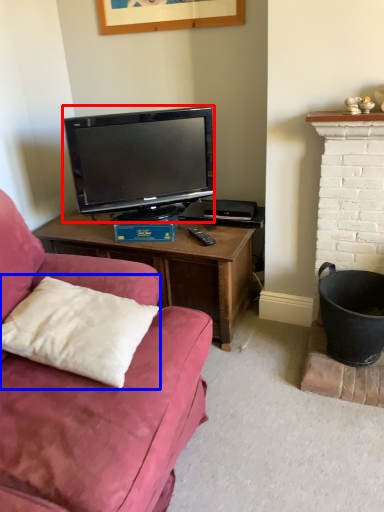
Question: Which point is further to the camera, television (highlighted by a red box) or pillow (highlighted by a blue box)?

Choices:
 (A) television
 (B) pillow

Answer: (A)